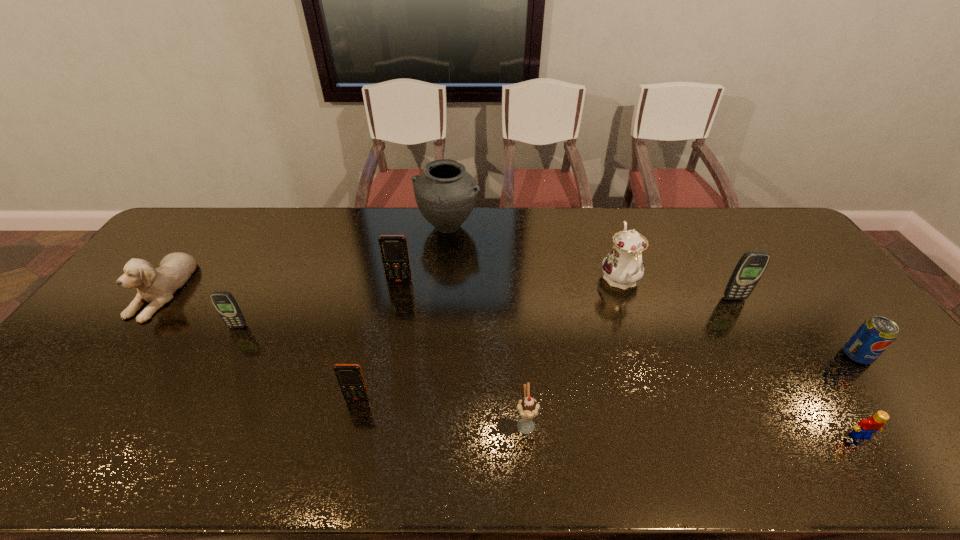
This screenshot has height=540, width=960. What are the coordinates of `the tallest object` in the screenshot? It's located at (445, 193).

Where is `urn`? urn is located at coordinates (445, 193).

This screenshot has width=960, height=540. Find the location of `the fourth object from right to left`. the fourth object from right to left is located at coordinates (622, 267).

The height and width of the screenshot is (540, 960). I want to click on the rightmost cellular telephone, so click(x=751, y=266).

I want to click on the third object from right to left, so click(x=751, y=266).

At what (x,y) coordinates should I click in order to perform the action: click on the bigger orange cellular telephone. Please return your answer as a coordinate pair (x, y). Looking at the image, I should click on (394, 252).

What are the coordinates of `the farthest cellular telephone` in the screenshot? It's located at (394, 252).

Image resolution: width=960 pixels, height=540 pixels. Find the location of `the leftmost object`. the leftmost object is located at coordinates (156, 286).

Locate an element on the screen. The image size is (960, 540). puppy is located at coordinates (156, 286).

This screenshot has height=540, width=960. Find the location of `the smaller orange cellular telephone`. the smaller orange cellular telephone is located at coordinates (350, 378).